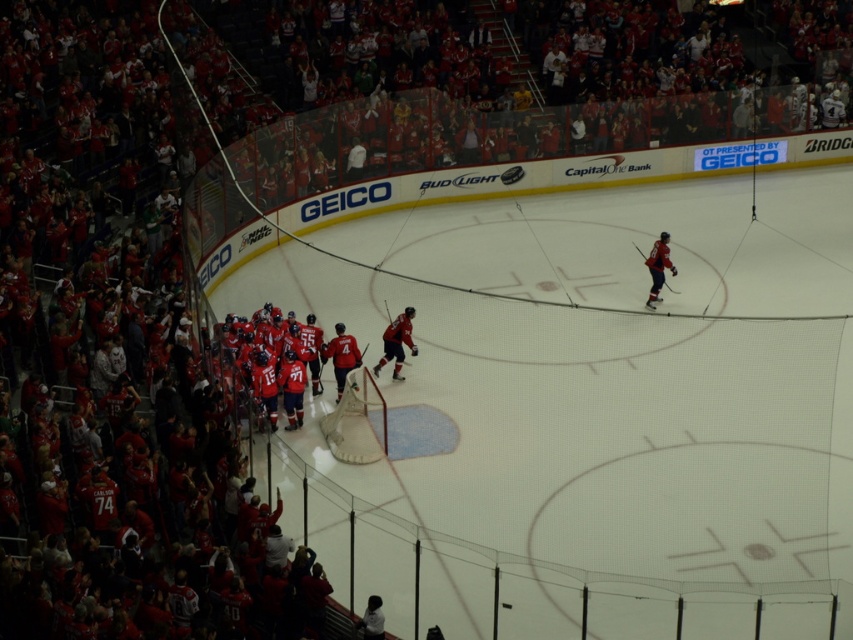
Question: Is matte red jersey at center below matte black hockey stick at center?

Choices:
 (A) no
 (B) yes

Answer: (B)

Question: Which of these objects is positioned farthest from the matte red jersey at right?

Choices:
 (A) matte red jersey at center
 (B) matte black hockey stick at center

Answer: (A)

Question: Which of these objects is positioned closest to the matte black hockey stick at center?

Choices:
 (A) red jersey at center
 (B) matte red jersey at right

Answer: (A)

Question: Is matte red jersey at center positioned at the back of matte red jersey at right?

Choices:
 (A) no
 (B) yes

Answer: (A)

Question: Can you confirm if matte black hockey stick at center is bigger than matte red jersey at right?

Choices:
 (A) yes
 (B) no

Answer: (B)

Question: Which of these objects is positioned farthest from the red jersey at center?

Choices:
 (A) matte black hockey stick at center
 (B) matte red jersey at right

Answer: (B)